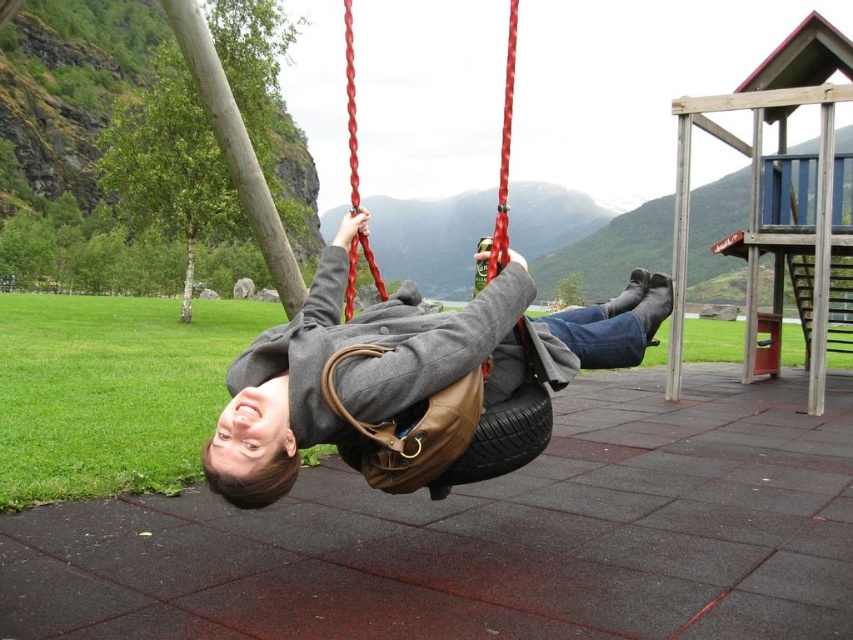
Which is below, gray wool coat at center or rubber tire swing at center?

Positioned lower is gray wool coat at center.

Who is taller, gray wool coat at center or rubber tire swing at center?

Standing taller between the two is rubber tire swing at center.

What are the coordinates of `gray wool coat at center` in the screenshot? It's located at (402, 364).